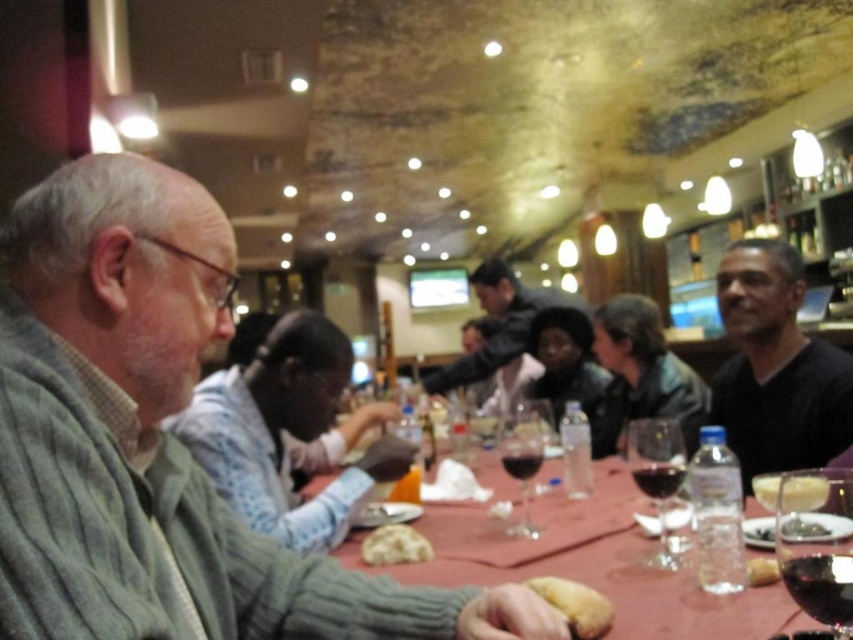
Is smooth yellow bread at lower center further to camera compared to green leafy salad at table center?

That is False.

Which is more to the left, smooth yellow bread at lower center or green leafy salad at table center?

From the viewer's perspective, smooth yellow bread at lower center appears more on the left side.

The image size is (853, 640). In order to click on smooth yellow bread at lower center in this screenshot , I will do `click(575, 605)`.

What do you see at coordinates (498, 323) in the screenshot? The image size is (853, 640). I see `dark gray sweater at center` at bounding box center [498, 323].

Between dark gray sweater at center and bread matte at table, which one appears on the right side from the viewer's perspective?

Positioned to the right is bread matte at table.

Who is more forward, (x=483, y=356) or (x=756, y=580)?

Point (x=756, y=580)

I want to click on dark gray sweater at center, so click(x=498, y=323).

Between dark brown leather jacket at center and dark red glass at lower right, which one is positioned lower?

dark red glass at lower right

Is point (688, 432) positioned before point (849, 596)?

No.

Locate an element on the screen. The image size is (853, 640). dark brown leather jacket at center is located at coordinates (642, 372).